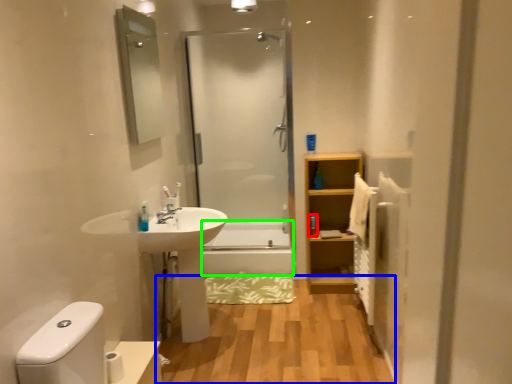
Question: Which is farther away from toiletry (highlighted by a red box)? hardwood (highlighted by a blue box) or bath (highlighted by a green box)?

Choices:
 (A) hardwood
 (B) bath

Answer: (A)